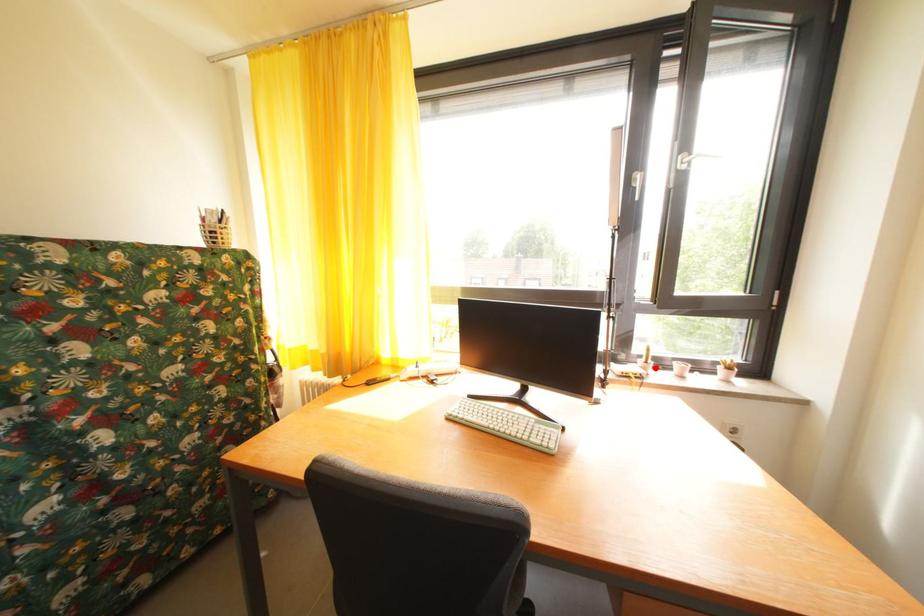
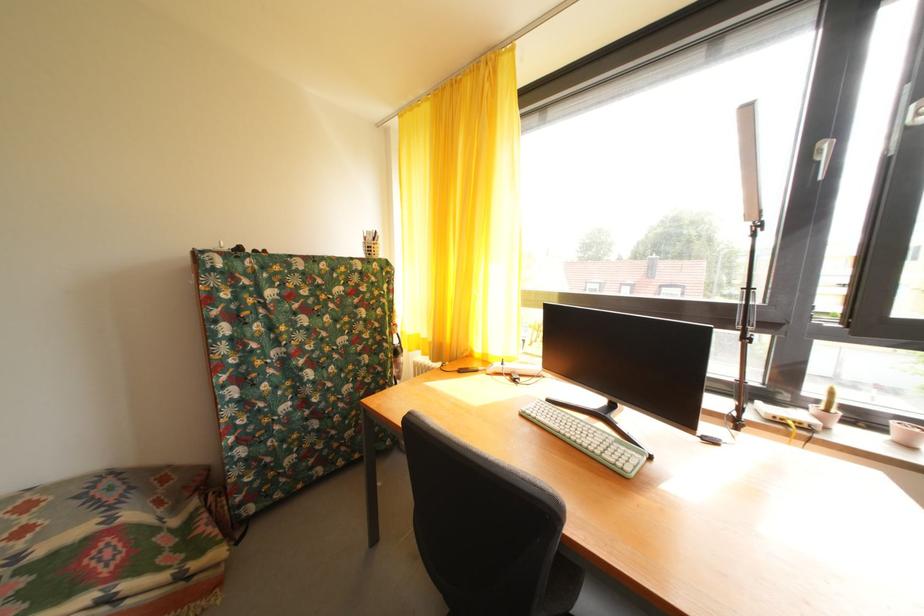
Locate, in the second image, the point that corresponds to the highlighted location in the first image.

(836, 416)